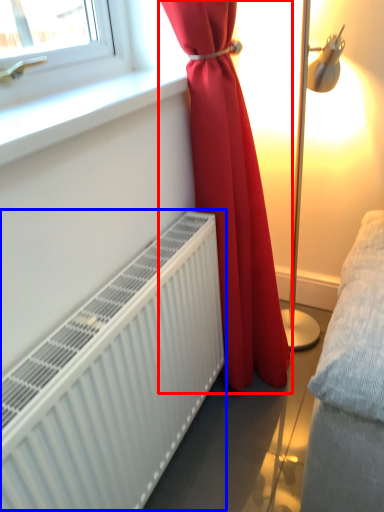
Question: Which point is further to the camera, curtain (highlighted by a red box) or radiator (highlighted by a blue box)?

Choices:
 (A) curtain
 (B) radiator

Answer: (A)